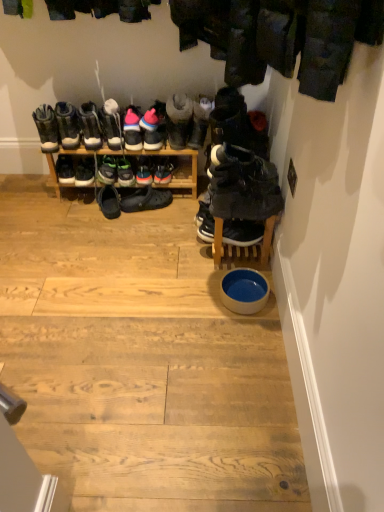
This screenshot has width=384, height=512. Identify the location of free space above black rubber shoes at center, which is counted as the ninth footwear, starting from the right (from a real-world perspective). (152, 184).